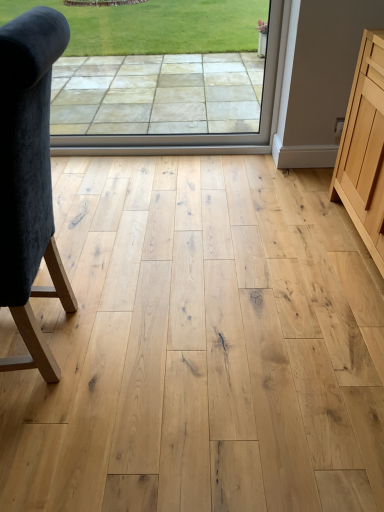
Find the location of a particular element. vacant area that is situated to the right of transparent glass window at center is located at coordinates (238, 170).